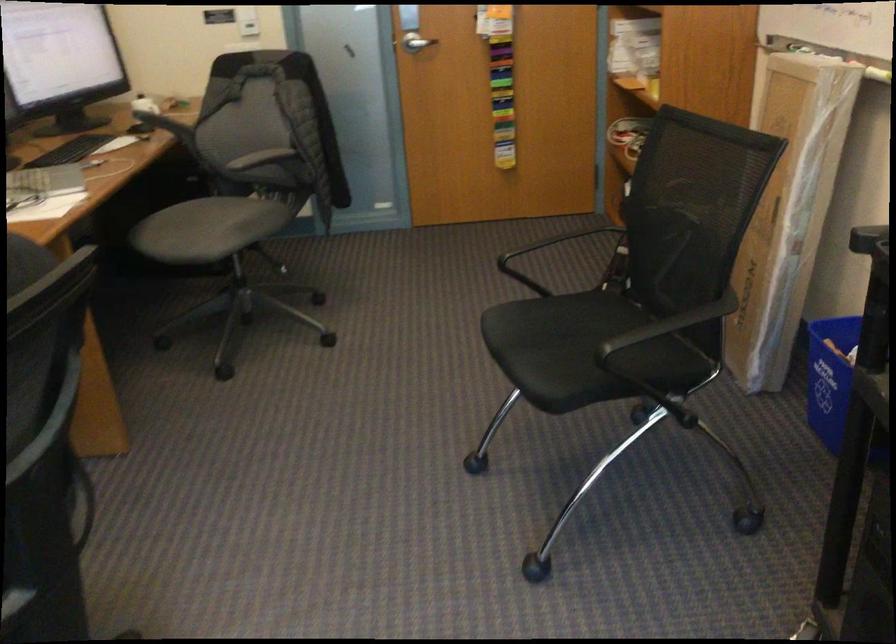
Find the location of a particular element. This screenshot has width=896, height=644. black chair sitting surface is located at coordinates (583, 351).